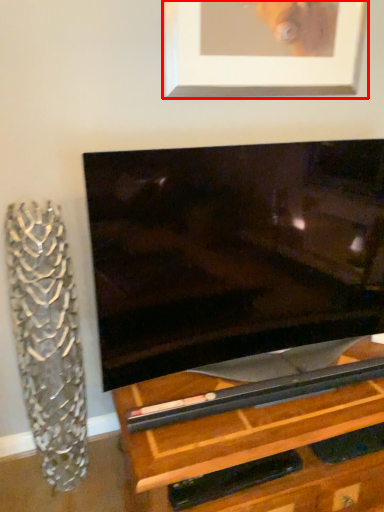
Question: From the image, what is the correct spatial relationship of picture frame (annotated by the red box) in relation to glass vase?

Choices:
 (A) right
 (B) left

Answer: (A)